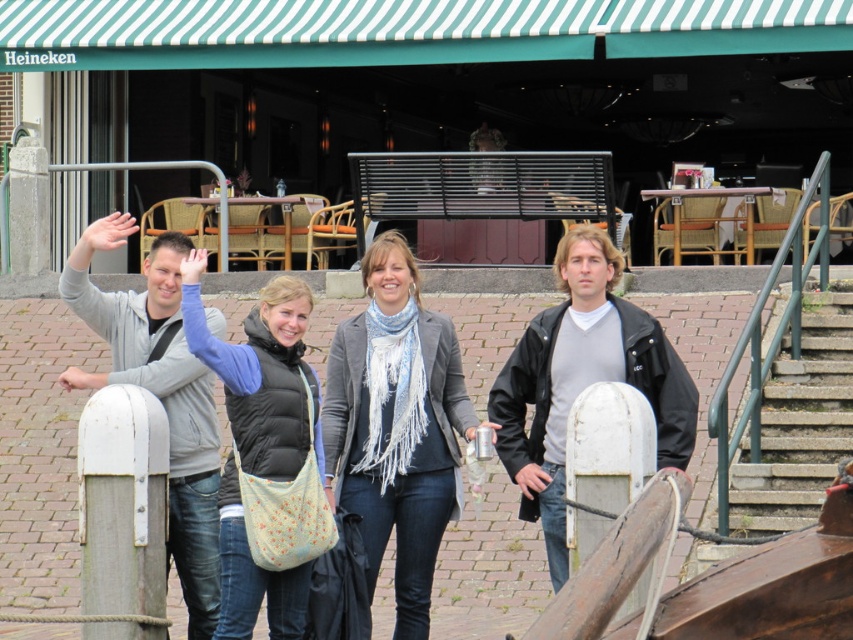
Is light blue quilted vest at center to the right of light skin tone hand at center from the viewer's perspective?

Indeed, light blue quilted vest at center is positioned on the right side of light skin tone hand at center.

Can you confirm if light blue quilted vest at center is shorter than light skin tone hand at center?

No.

Who is more distant from viewer, (300,564) or (76,388)?

Positioned behind is point (76,388).

Find the location of a particular element. light blue quilted vest at center is located at coordinates (259, 440).

Does point (840, 339) come closer to viewer compared to point (119, 214)?

No, it is not.

The height and width of the screenshot is (640, 853). In order to click on concrete stairs at right in this screenshot , I will do pyautogui.click(x=798, y=420).

Between point (814, 388) and point (91, 237), which one is positioned behind?

The point (814, 388) is behind.

Identify the location of concrete stairs at right. This screenshot has height=640, width=853. (798, 420).

Between gray fleece jacket at left and light skin tone hand at center, which one appears on the right side from the viewer's perspective?

gray fleece jacket at left

Is point (184, 440) more distant than point (77, 378)?

Yes, point (184, 440) is behind point (77, 378).

Describe the element at coordinates (165, 406) in the screenshot. I see `gray fleece jacket at left` at that location.

Where is `gray fleece jacket at left`? This screenshot has height=640, width=853. gray fleece jacket at left is located at coordinates [x=165, y=406].